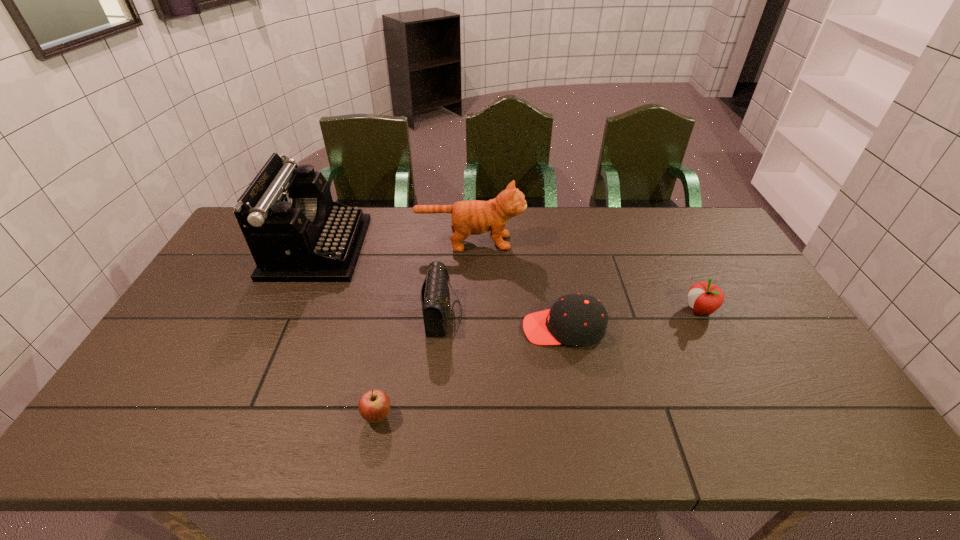
Where is `free point between the fifth shortest object and the cap`? This screenshot has height=540, width=960. free point between the fifth shortest object and the cap is located at coordinates (516, 285).

I want to click on free spot between the second tallest object and the clutch bag, so click(x=456, y=278).

Locate an element on the screen. empty space that is in between the shortest object and the taller apple is located at coordinates (539, 363).

Where is `vacant area that lies between the typewriter and the taller apple`? This screenshot has height=540, width=960. vacant area that lies between the typewriter and the taller apple is located at coordinates (508, 279).

Where is `the fifth closest object to the taller apple`? the fifth closest object to the taller apple is located at coordinates (295, 232).

You are a GUI agent. You are given a task and a screenshot of the screen. Output one action in this format:
    pyautogui.click(x=<x>, y=<y>)
    Task: Click on the second closest object to the clutch bag
    
    Given the screenshot: What is the action you would take?
    pyautogui.click(x=473, y=217)

Where is `vacant region that satisfies the following two spatial constraints: 1. on the typing side of the typewriter; 2. on the right side of the shortest object`? vacant region that satisfies the following two spatial constraints: 1. on the typing side of the typewriter; 2. on the right side of the shortest object is located at coordinates (242, 416).

You are a GUI agent. You are given a task and a screenshot of the screen. Output one action in this format:
    pyautogui.click(x=<x>, y=<y>)
    Task: Click on the free space that satisfies the following two spatial constraints: 1. on the front side of the taller apple; 2. on the front flap of the clutch bag
    The width and height of the screenshot is (960, 540).
    Given the screenshot: What is the action you would take?
    pyautogui.click(x=701, y=313)

Locate an element on the screen. vacant area in the image that satisfies the following two spatial constraints: 1. on the front side of the farther apple; 2. on the front flap of the clutch bag is located at coordinates (701, 313).

Locate an element on the screen. This screenshot has height=540, width=960. free spot that satisfies the following two spatial constraints: 1. on the typing side of the right apple; 2. on the right side of the tallest object is located at coordinates (289, 310).